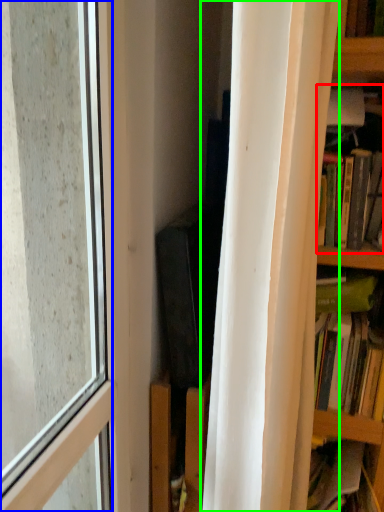
Question: Based on their relative distances, which object is nearer to book (highlighted by a red box)? Choose from window (highlighted by a blue box) and curtain (highlighted by a green box).

Choices:
 (A) window
 (B) curtain

Answer: (B)